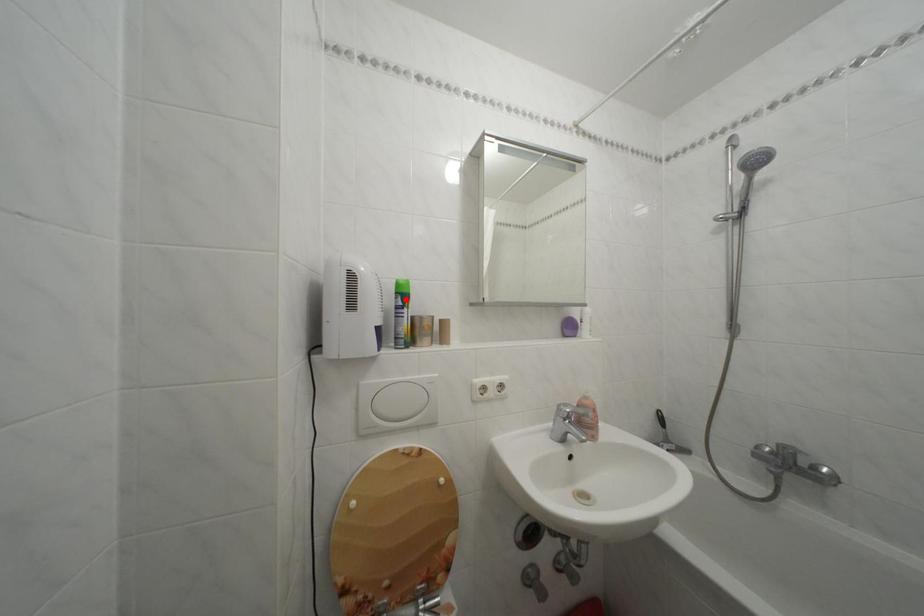
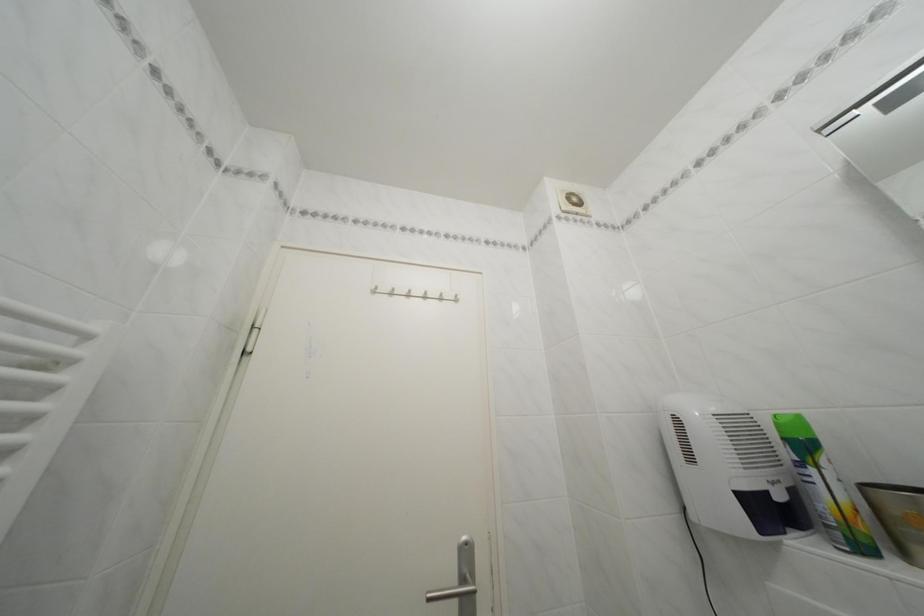
Find the pixel in the second image that matches the highlighted location in the first image.

(793, 445)